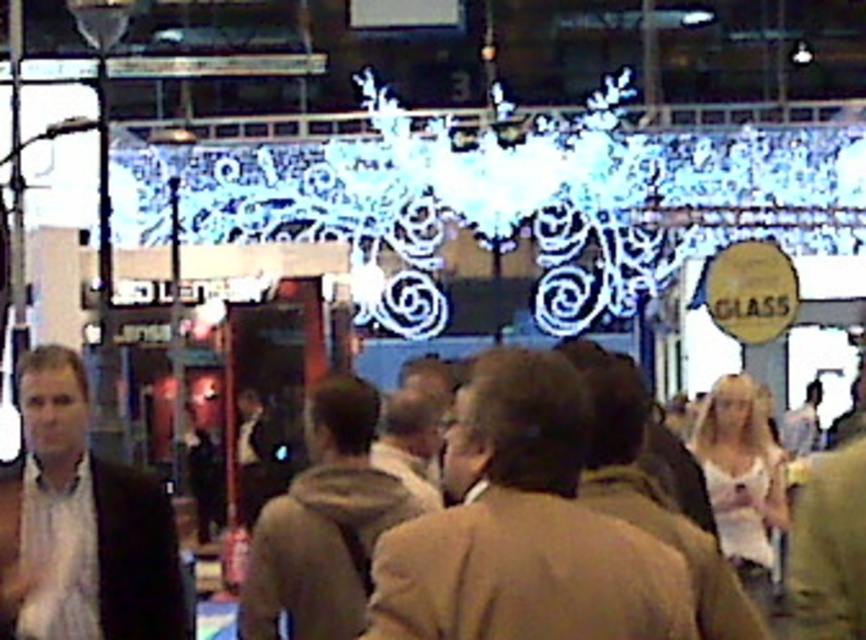
Which is below, brown fabric jacket at center or brown fuzzy jacket at center?

Positioned lower is brown fuzzy jacket at center.

Between brown fabric jacket at center and brown fuzzy jacket at center, which one has more height?

With more height is brown fabric jacket at center.

Does point (535, 525) lie behind point (347, 451)?

That is False.

Locate an element on the screen. This screenshot has height=640, width=866. brown fabric jacket at center is located at coordinates (522, 529).

Does point (85, 387) come in front of point (268, 538)?

Yes, point (85, 387) is in front of point (268, 538).

Describe the element at coordinates (81, 524) in the screenshot. This screenshot has height=640, width=866. I see `white shirt at left` at that location.

This screenshot has width=866, height=640. In order to click on white shirt at left in this screenshot , I will do `click(81, 524)`.

Is brown fabric jacket at center further to camera compared to white shirt at left?

No, brown fabric jacket at center is in front of white shirt at left.

Describe the element at coordinates (522, 529) in the screenshot. I see `brown fabric jacket at center` at that location.

Locate an element on the screen. This screenshot has width=866, height=640. brown fabric jacket at center is located at coordinates (522, 529).